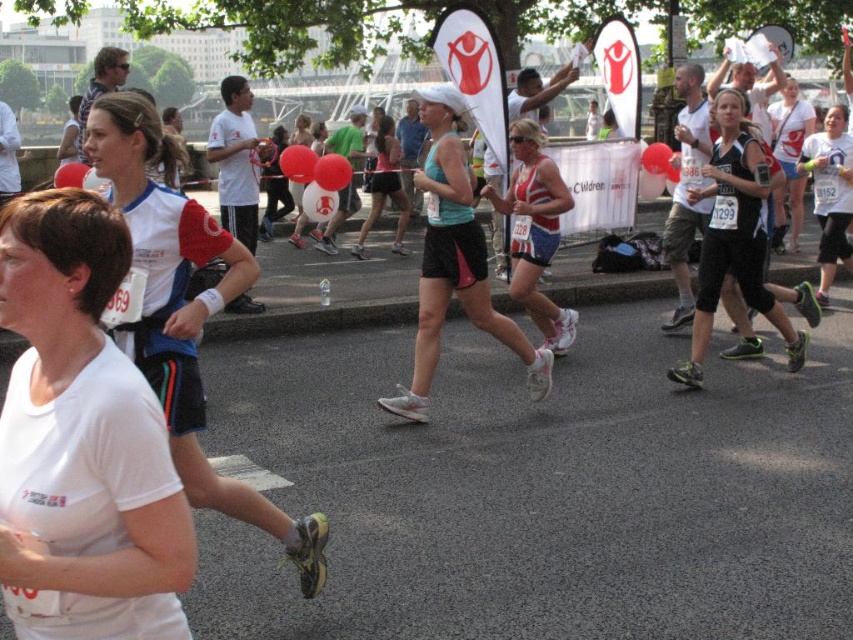
Who is positioned more to the left, white matte running shoe at left or matte white tank top at center?

white matte running shoe at left is more to the left.

Image resolution: width=853 pixels, height=640 pixels. I want to click on white matte running shoe at left, so click(184, 312).

This screenshot has width=853, height=640. I want to click on white matte t-shirt at center, so click(82, 440).

What do you see at coordinates (82, 440) in the screenshot?
I see `white matte t-shirt at center` at bounding box center [82, 440].

Where is `white matte t-shirt at center`? white matte t-shirt at center is located at coordinates (82, 440).

Looking at this image, measure the distance between white matte t-shirt at center and matte white tank top at center.

white matte t-shirt at center is 18.34 feet from matte white tank top at center.

Is white matte t-shirt at center to the right of matte white tank top at center from the viewer's perspective?

In fact, white matte t-shirt at center is to the left of matte white tank top at center.

Measure the distance between point (73, 529) and camera.

Point (73, 529) and camera are 5.90 feet apart from each other.

Identify the location of white matte t-shirt at center. (82, 440).